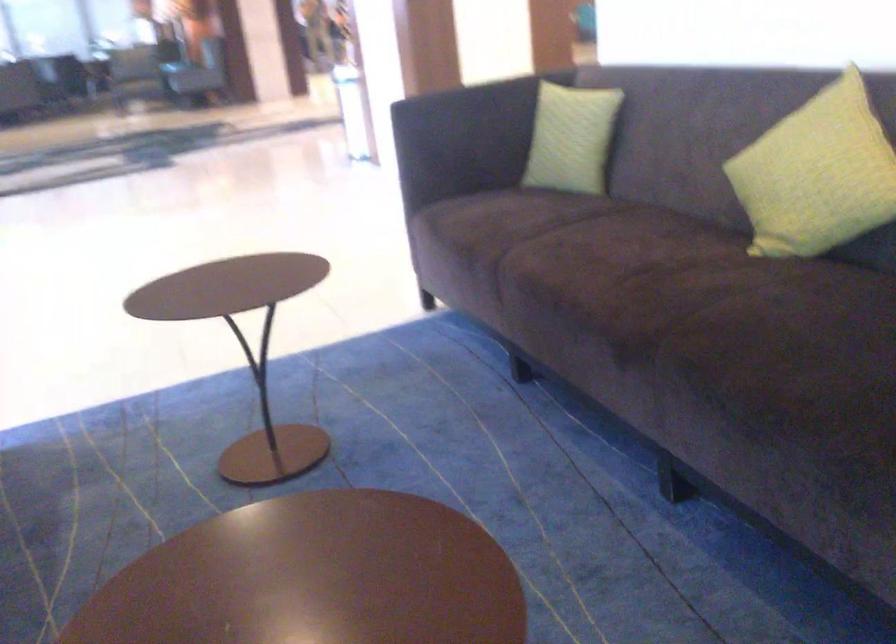
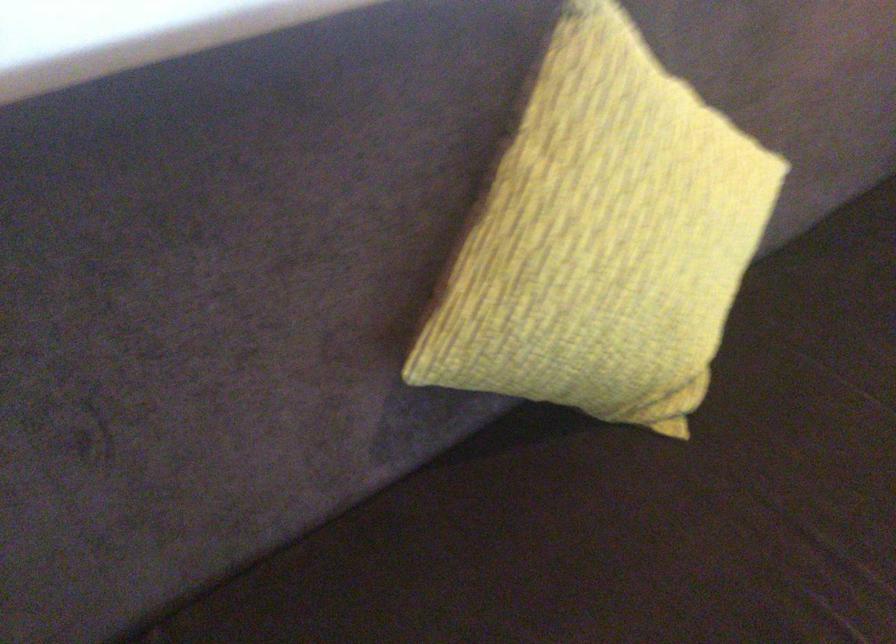
Where in the second image is the point corresponding to the point at 796,143 from the first image?

(602, 237)